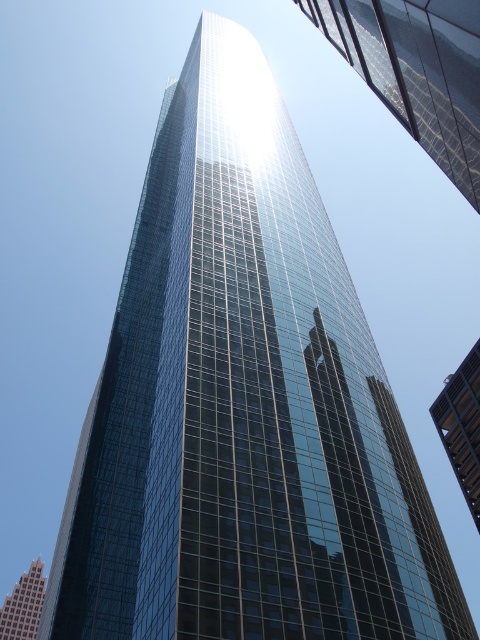
Can you confirm if glassy reflective skyscraper at center is taller than shiny glass skyscraper at center?

In fact, glassy reflective skyscraper at center may be shorter than shiny glass skyscraper at center.

Can you confirm if glassy reflective skyscraper at center is positioned to the left of shiny glass skyscraper at center?

No, glassy reflective skyscraper at center is not to the left of shiny glass skyscraper at center.

In the scene shown: Who is more distant from viewer, (x=468, y=492) or (x=12, y=636)?

The point (x=12, y=636) is behind.

Where is `glassy reflective skyscraper at center`? This screenshot has width=480, height=640. glassy reflective skyscraper at center is located at coordinates point(462,426).

You are a GUI agent. You are given a task and a screenshot of the screen. Output one action in this format:
    pyautogui.click(x=<x>, y=<y>)
    Task: Click on the shiny glass skyscraper at upper right
    The image size is (480, 640).
    Given the screenshot: What is the action you would take?
    pyautogui.click(x=417, y=70)

Does shiny glass skyscraper at upper right lie behind glassy reflective skyscraper at center?

That is False.

Between point (369, 65) and point (477, 404), which one is positioned behind?

The point (477, 404) is more distant.

At what (x,y) coordinates should I click in order to perform the action: click on shiny glass skyscraper at upper right. Please return your answer as a coordinate pair (x, y). This screenshot has width=480, height=640. Looking at the image, I should click on (417, 70).

Does shiny glass skyscraper at upper right come behind shiny glass skyscraper at center?

No, shiny glass skyscraper at upper right is in front of shiny glass skyscraper at center.

Is shiny glass skyscraper at upper right bigger than shiny glass skyscraper at center?

Actually, shiny glass skyscraper at upper right might be smaller than shiny glass skyscraper at center.

Find the location of a particular element. The width and height of the screenshot is (480, 640). shiny glass skyscraper at upper right is located at coordinates (417, 70).